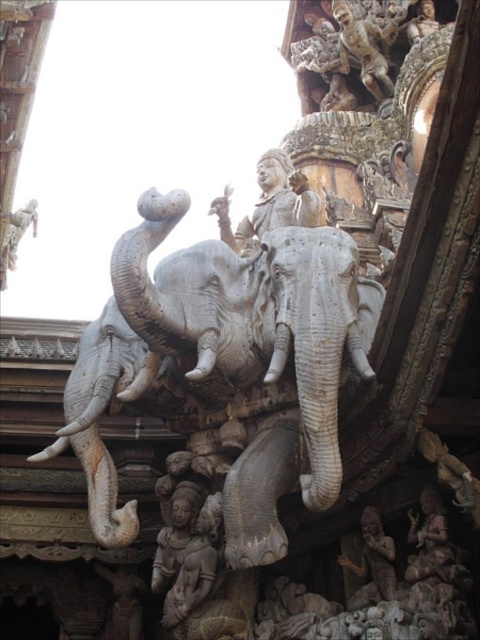
You are an art conservator assessing the structural integrity of the gray stone elephant at center and the carved stone statue at center. Which object has a greater width, potentially requiring more space for preservation?

The gray stone elephant at center might be wider than the carved stone statue at center, so it may require more space for preservation.

You are standing in front of a stone sculpture and see the gray stone elephant at center and the gray stone elephant at left. Which elephant is positioned closer to you?

The gray stone elephant at center is closer to the viewer than the gray stone elephant at left.